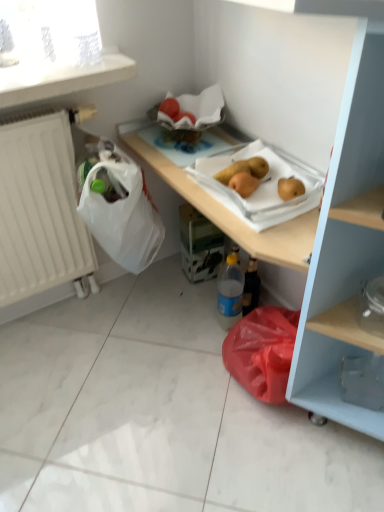
Find the location of a particular element. This screenshot has height=512, width=384. free space in front of transparent plastic carton at center is located at coordinates (201, 296).